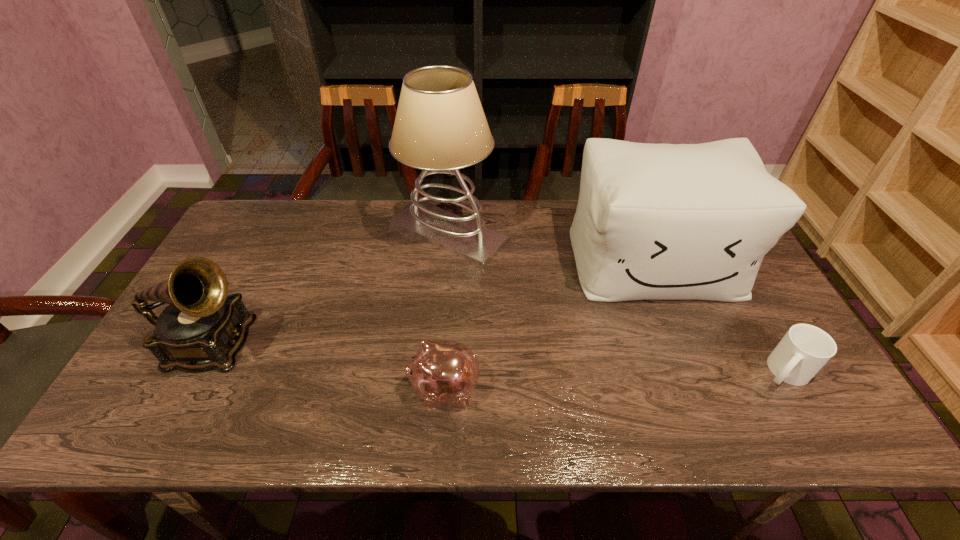
At what (x,y) coordinates should I click in order to perform the action: click on the tallest object. Please return your answer as a coordinate pair (x, y). The height and width of the screenshot is (540, 960). Looking at the image, I should click on (440, 127).

Locate an element on the screen. cushion is located at coordinates [654, 221].

The height and width of the screenshot is (540, 960). In order to click on the leftmost object in this screenshot , I will do `click(203, 328)`.

Where is `piggy bank`? Image resolution: width=960 pixels, height=540 pixels. piggy bank is located at coordinates (442, 372).

You are a GUI agent. You are given a task and a screenshot of the screen. Output one action in this format:
    pyautogui.click(x=<x>, y=<y>)
    Task: Click on the shortest object
    
    Given the screenshot: What is the action you would take?
    pyautogui.click(x=805, y=349)

The width and height of the screenshot is (960, 540). Find the location of `vacant space located 0.120m on the left of the table lamp`. vacant space located 0.120m on the left of the table lamp is located at coordinates (350, 232).

This screenshot has height=540, width=960. What are the coordinates of `free space located on the side of the cushion with the smiley face` in the screenshot? It's located at (712, 407).

Image resolution: width=960 pixels, height=540 pixels. Identify the location of free space located on the horn of the leftmost object. (364, 345).

Where is `vacant region located on the front facing side of the fourth tallest object`? vacant region located on the front facing side of the fourth tallest object is located at coordinates (379, 389).

Locate an element on the screen. The image size is (960, 540). vacant space located 0.080m on the front facing side of the fourth tallest object is located at coordinates (374, 389).